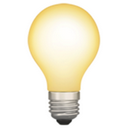
At what (x,y) coordinates should I click in order to perform the action: click on glass. Please return your answer as a coordinate pair (x, y). Looking at the image, I should click on (59, 72).